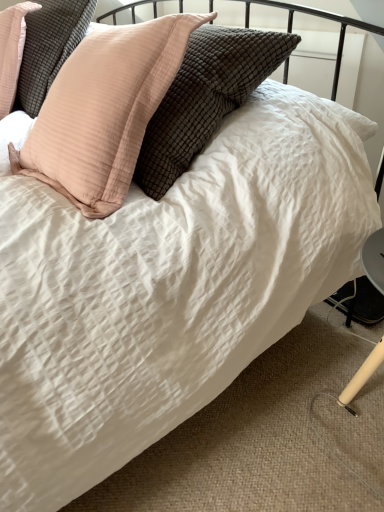
Question: Is matte pink pillow at upper left, which is counted as the 2th pillow, starting from the left, located outside peach striped pillow at upper left, which appears as the first pillow when viewed from the left?

Choices:
 (A) yes
 (B) no

Answer: (A)

Question: Can you confirm if matte pink pillow at upper left, marked as the 1th pillow in a right-to-left arrangement, is positioned to the right of peach striped pillow at upper left, which appears as the first pillow when viewed from the left?

Choices:
 (A) no
 (B) yes

Answer: (B)

Question: Is matte pink pillow at upper left, marked as the 1th pillow in a right-to-left arrangement, further to camera compared to peach striped pillow at upper left, which appears as the first pillow when viewed from the left?

Choices:
 (A) yes
 (B) no

Answer: (B)

Question: Can you confirm if matte pink pillow at upper left, which is counted as the 2th pillow, starting from the left, is smaller than peach striped pillow at upper left, which appears as the first pillow when viewed from the left?

Choices:
 (A) yes
 (B) no

Answer: (B)

Question: Are matte pink pillow at upper left, marked as the 1th pillow in a right-to-left arrangement, and peach striped pillow at upper left, which appears as the first pillow when viewed from the left, located far from each other?

Choices:
 (A) no
 (B) yes

Answer: (A)

Question: Is the surface of matte pink pillow at upper left, which is counted as the 2th pillow, starting from the left, in direct contact with peach striped pillow at upper left, acting as the 2th pillow starting from the right?

Choices:
 (A) no
 (B) yes

Answer: (A)

Question: Does peach striped pillow at upper left, acting as the 2th pillow starting from the right, appear on the left side of matte pink pillow at upper left, which is counted as the 2th pillow, starting from the left?

Choices:
 (A) yes
 (B) no

Answer: (A)

Question: Is peach striped pillow at upper left, acting as the 2th pillow starting from the right, with matte pink pillow at upper left, which is counted as the 2th pillow, starting from the left?

Choices:
 (A) yes
 (B) no

Answer: (B)

Question: Is peach striped pillow at upper left, which appears as the first pillow when viewed from the left, turned away from matte pink pillow at upper left, marked as the 1th pillow in a right-to-left arrangement?

Choices:
 (A) yes
 (B) no

Answer: (B)

Question: Is peach striped pillow at upper left, acting as the 2th pillow starting from the right, not near matte pink pillow at upper left, which is counted as the 2th pillow, starting from the left?

Choices:
 (A) yes
 (B) no

Answer: (B)

Question: From the image's perspective, is peach striped pillow at upper left, acting as the 2th pillow starting from the right, under matte pink pillow at upper left, which is counted as the 2th pillow, starting from the left?

Choices:
 (A) no
 (B) yes

Answer: (A)

Question: Is peach striped pillow at upper left, acting as the 2th pillow starting from the right, thinner than matte pink pillow at upper left, marked as the 1th pillow in a right-to-left arrangement?

Choices:
 (A) yes
 (B) no

Answer: (B)

Question: Considering the positions of matte pink pillow at upper left, which is counted as the 2th pillow, starting from the left, and peach striped pillow at upper left, which appears as the first pillow when viewed from the left, in the image, is matte pink pillow at upper left, which is counted as the 2th pillow, starting from the left, bigger or smaller than peach striped pillow at upper left, which appears as the first pillow when viewed from the left,?

Choices:
 (A) small
 (B) big

Answer: (B)